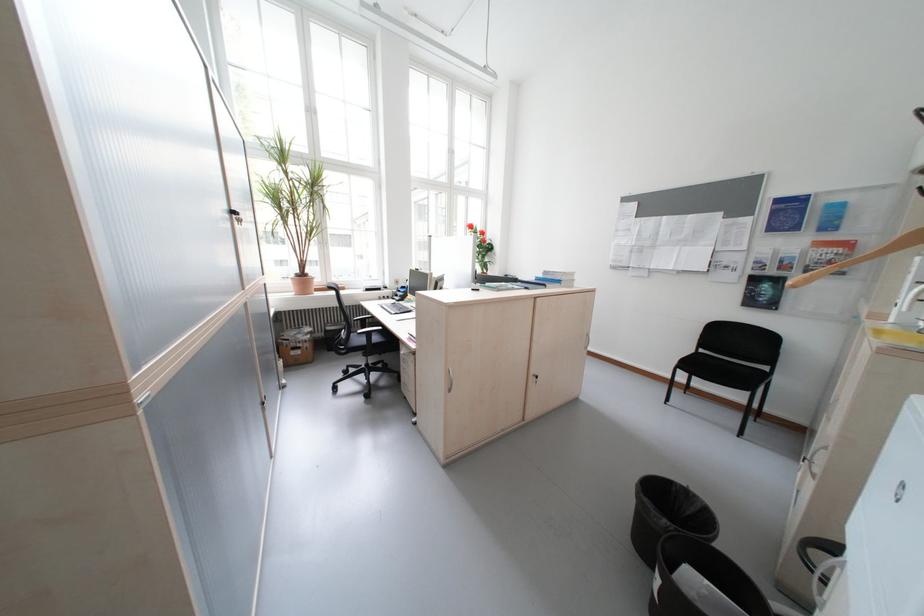
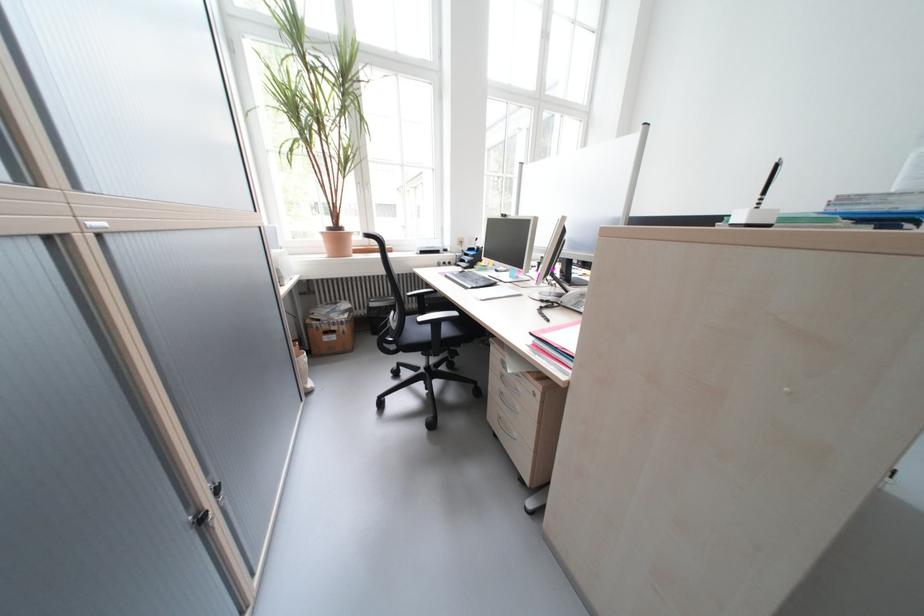
Where in the second image is the point corresponding to (308,277) from the first image?

(339, 231)